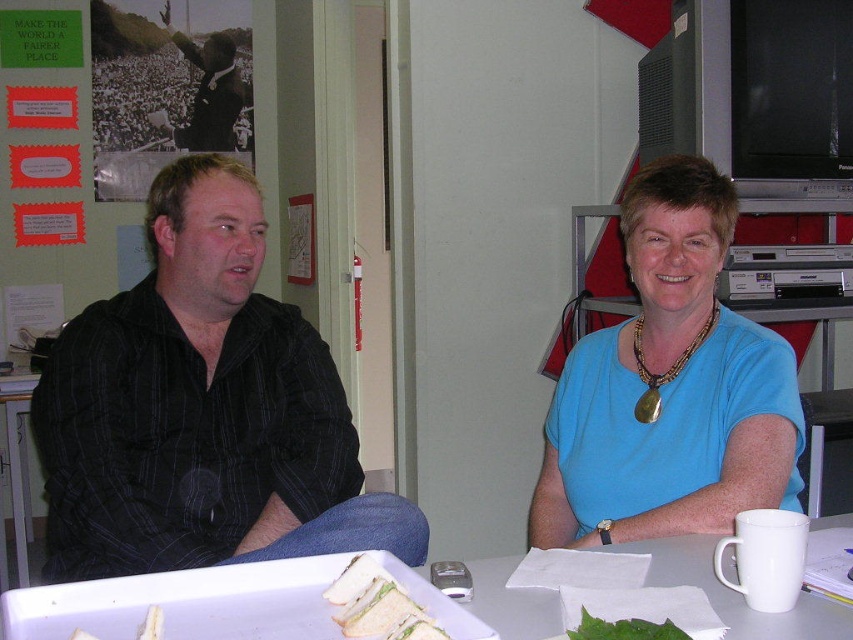
You are a delivery person who needs to place a small package on the table. The package is 12 inches in length. You see the white plastic tray at center. Can you fit the package on the table without it hanging over the edge?

The white plastic tray at center is 36.48 inches away from the viewer, but this distance does not indicate the size of the tray. Therefore, it is unclear if the 12 inch package can fit on the tray without hanging over the edge based on the provided information.

You are standing at the point labeled as point (618, 621) and want to move to the door located at point (668, 461). Is the door behind you or in front of you?

The point (668, 461) is behind point (618, 621), so the door located at point (668, 461) is behind you.

You are a guest at this table and want to place your phone on the white plastic tray at center without it falling off. Considering the black suit jacket at upper left is nearby, which object should you avoid placing the phone too close to?

You should avoid placing the phone too close to the black suit jacket at upper left because the white plastic tray at center is shorter than the black suit jacket at upper left, meaning the jacket is taller and could potentially knock the phone off the tray if it moves.